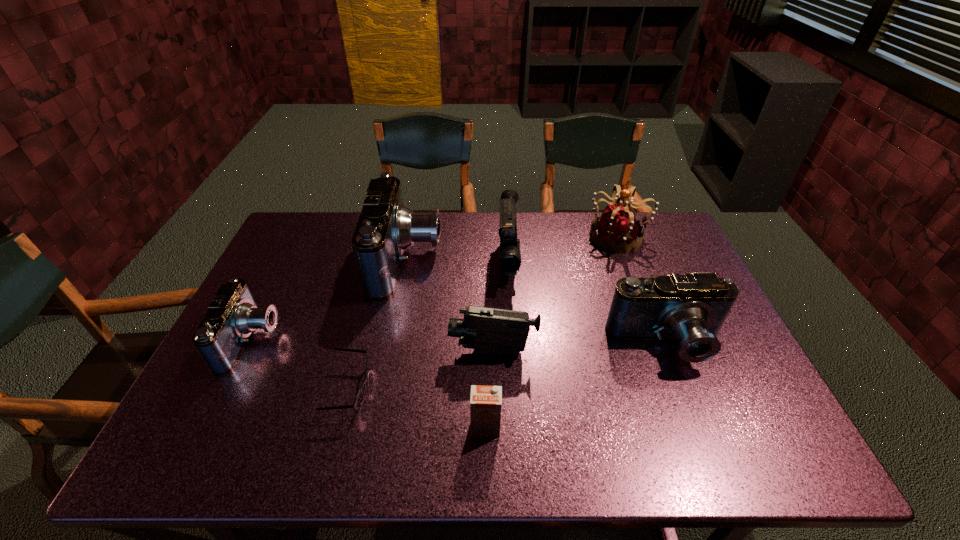
I want to click on the biggest blue camcorder, so click(x=385, y=228).

Where is `the second blue camcorder from right to left`? This screenshot has width=960, height=540. the second blue camcorder from right to left is located at coordinates (385, 228).

Where is `red tiara`? Image resolution: width=960 pixels, height=540 pixels. red tiara is located at coordinates (618, 229).

Locate an element on the screen. This screenshot has width=960, height=540. the farther black camcorder is located at coordinates (509, 249).

What are the coordinates of `the second smallest blue camcorder` in the screenshot? It's located at (691, 308).

You are a GUI agent. You are given a task and a screenshot of the screen. Output one action in this format:
    pyautogui.click(x=<x>, y=<y>)
    Task: Click on the rightmost blue camcorder
    The width and height of the screenshot is (960, 540).
    Given the screenshot: What is the action you would take?
    pyautogui.click(x=691, y=308)

You are a GUI agent. You are given a task and a screenshot of the screen. Output one action in this format:
    pyautogui.click(x=<x>, y=<y>)
    Task: Click on the nearer black camcorder
    This screenshot has height=540, width=960.
    Given the screenshot: What is the action you would take?
    pyautogui.click(x=486, y=330)

I want to click on the leftmost blue camcorder, so click(x=232, y=316).

The width and height of the screenshot is (960, 540). In order to click on the smallest blue camcorder in this screenshot , I will do `click(232, 316)`.

Where is `orange orange juice`? orange orange juice is located at coordinates (485, 401).